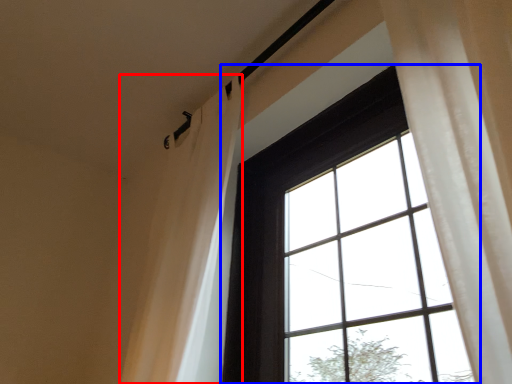
Question: Which object appears farthest to the camera in this image, shower curtain (highlighted by a red box) or window (highlighted by a blue box)?

Choices:
 (A) shower curtain
 (B) window

Answer: (A)